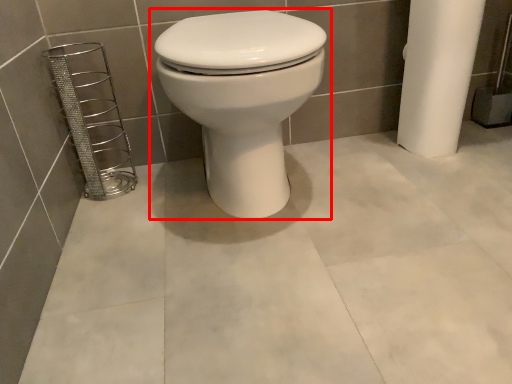
Question: From the image's perspective, what is the correct spatial positioning of toilet (annotated by the red box) in reference to porcelain?

Choices:
 (A) above
 (B) below

Answer: (A)